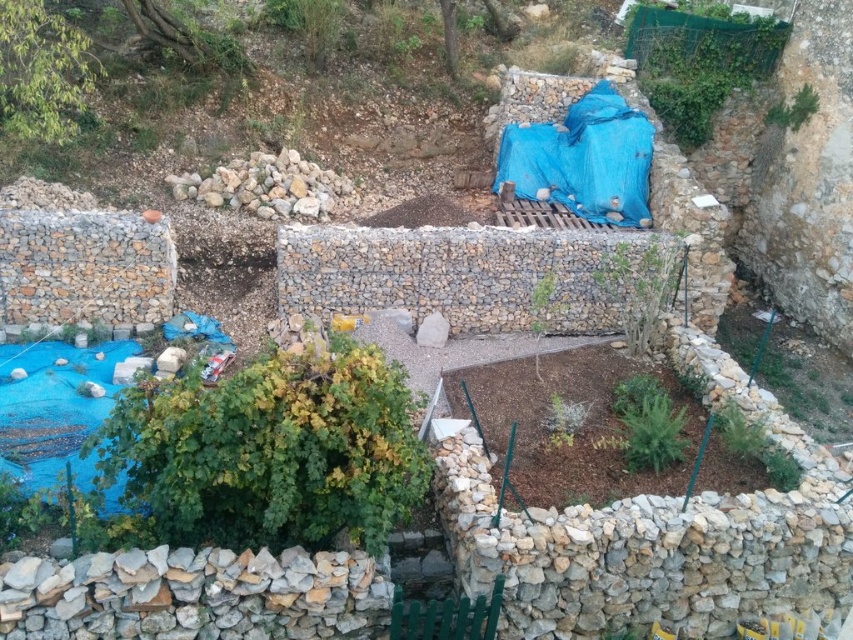
Question: Can you confirm if natural stone wall at lower left is thinner than natural stone at center?

Choices:
 (A) yes
 (B) no

Answer: (B)

Question: Which point is closer to the camera taking this photo?

Choices:
 (A) (164, 586)
 (B) (281, 166)

Answer: (A)

Question: Can you confirm if natural stone wall at lower left is smaller than natural stone at center?

Choices:
 (A) yes
 (B) no

Answer: (A)

Question: Which object is closer to the camera taking this photo?

Choices:
 (A) natural stone wall at lower left
 (B) natural stone at center

Answer: (A)

Question: Among these objects, which one is farthest from the camera?

Choices:
 (A) natural stone wall at lower left
 (B) natural stone at center

Answer: (B)

Question: Can you confirm if natural stone wall at lower left is thinner than natural stone at center?

Choices:
 (A) yes
 (B) no

Answer: (B)